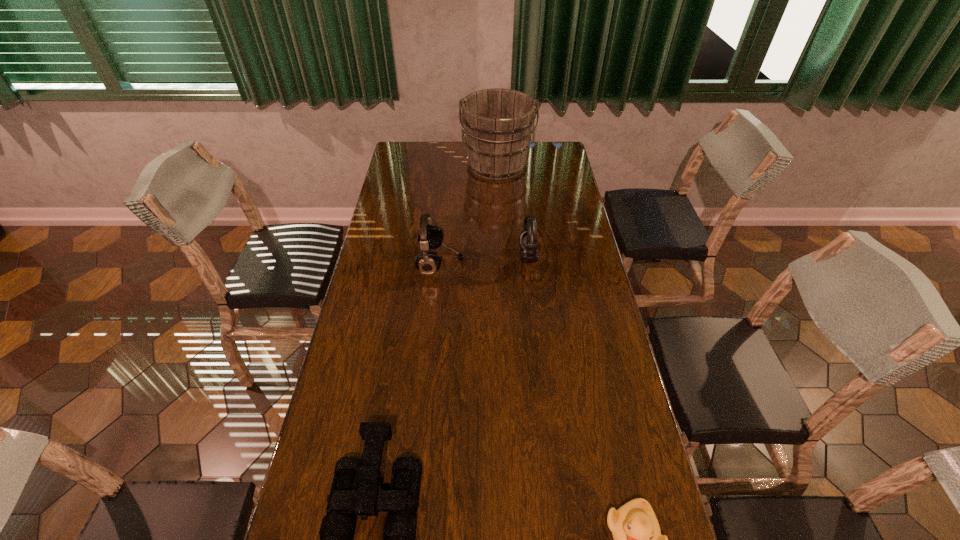
Identify the location of free point that satisfies the following two spatial constraints: 1. on the handle side of the farthest object; 2. with the microphone on the side of the second tallest object. The image size is (960, 540). (502, 262).